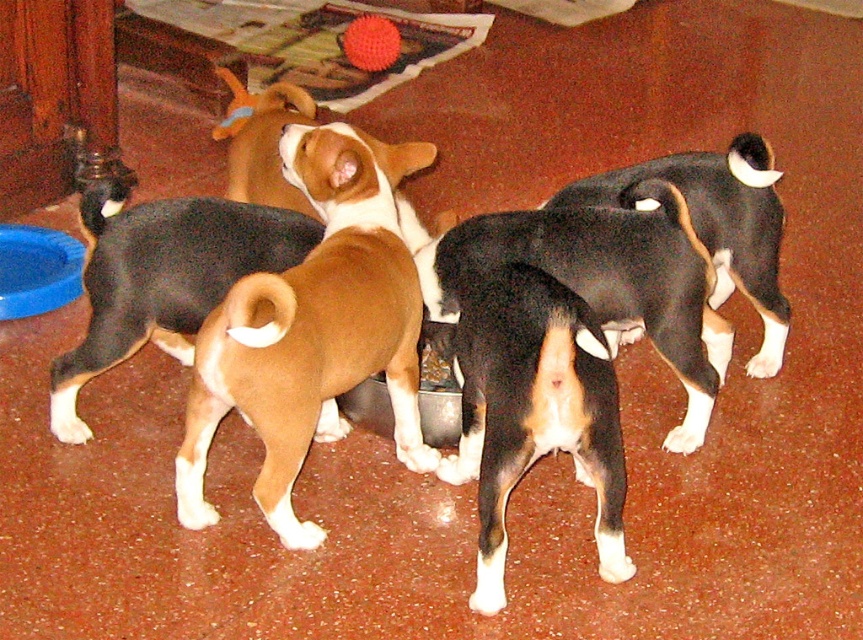
Question: Does brown matte dog at center appear under black and white fur at center?

Choices:
 (A) no
 (B) yes

Answer: (B)

Question: Among these objects, which one is farthest from the camera?

Choices:
 (A) black and white fur at center
 (B) rubber toy at upper center
 (C) blue plastic bowl at lower left

Answer: (B)

Question: Does brown matte dog at center appear on the right side of black and white fur at center?

Choices:
 (A) yes
 (B) no

Answer: (B)

Question: Which object is positioned closest to the rubber ball at center?

Choices:
 (A) brown fur at center
 (B) brown and white fur at center
 (C) blue plastic bowl at lower left

Answer: (C)

Question: Considering the real-world distances, which object is farthest from the rubber ball at center?

Choices:
 (A) blue plastic bowl at lower left
 (B) brown and white fur at center

Answer: (B)

Question: Can you confirm if brown matte dog at center is positioned to the right of blue plastic bowl at lower left?

Choices:
 (A) yes
 (B) no

Answer: (A)